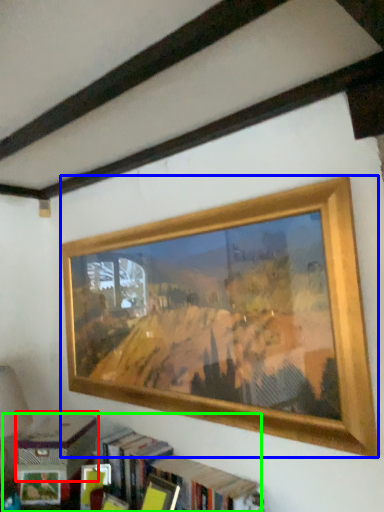
Question: Which object is positioned farthest from paperback book (highlighted by a red box)? Select from picture frame (highlighted by a blue box) and bookcase (highlighted by a green box).

Choices:
 (A) picture frame
 (B) bookcase

Answer: (A)